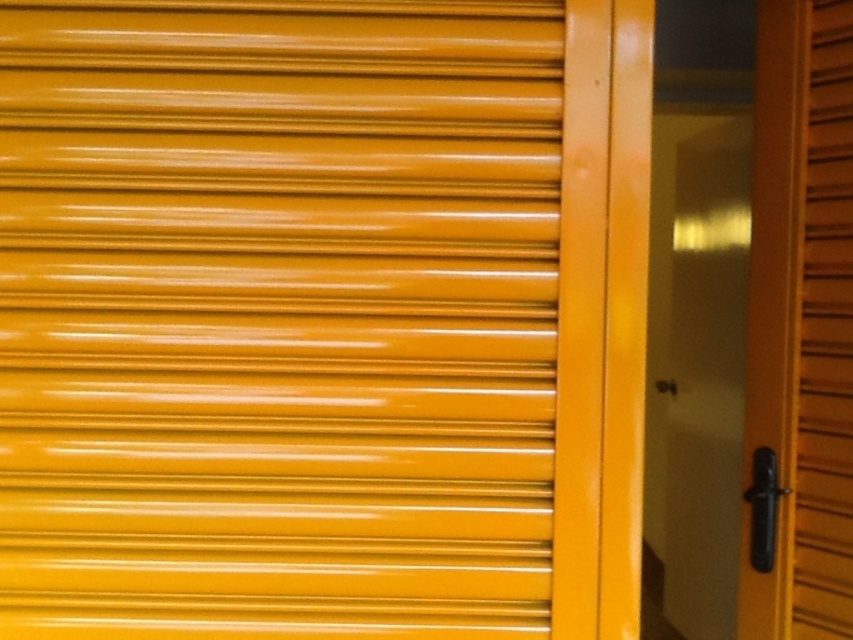
Question: Estimate the real-world distances between objects in this image. Which object is farther from the glossy yellow shutter at center?

Choices:
 (A) matte yellow screen door at right
 (B) matte yellow shutter at right

Answer: (A)

Question: Which point is farther from the camera taking this photo?

Choices:
 (A) (740, 346)
 (B) (816, 461)
 (C) (20, 220)

Answer: (A)

Question: Does glossy yellow shutter at center have a larger size compared to matte yellow shutter at right?

Choices:
 (A) yes
 (B) no

Answer: (A)

Question: Which point appears closest to the camera in this image?

Choices:
 (A) (236, 179)
 (B) (807, 394)
 (C) (692, 387)

Answer: (A)

Question: Does matte yellow screen door at right have a lesser width compared to matte yellow shutter at right?

Choices:
 (A) yes
 (B) no

Answer: (B)

Question: Is glossy yellow shutter at center bigger than matte yellow screen door at right?

Choices:
 (A) yes
 (B) no

Answer: (B)